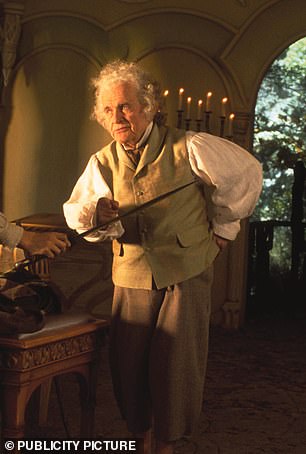
Where is `candles`? candles is located at coordinates (220, 126).